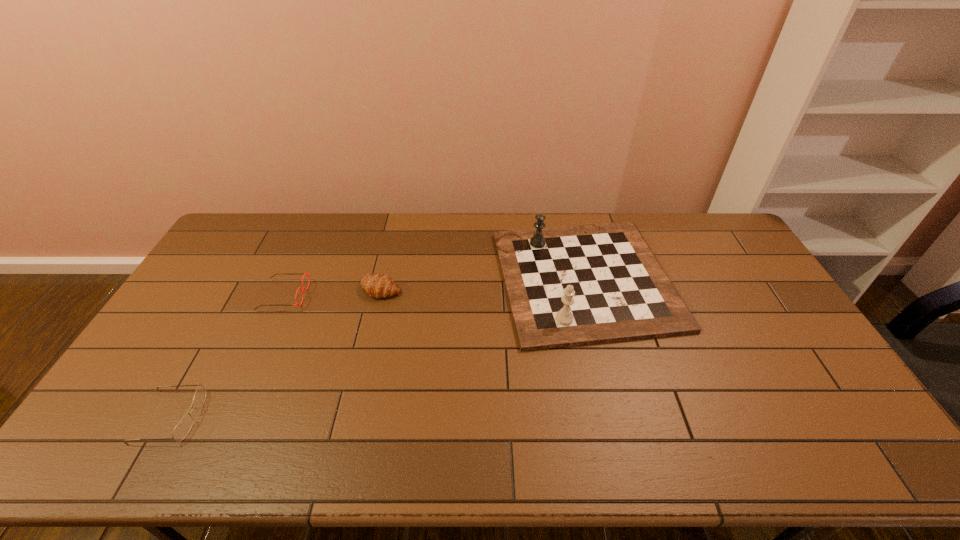
The image size is (960, 540). Find the location of `the rightmost object`. the rightmost object is located at coordinates pos(567,286).

Locate an element on the screen. gameboard is located at coordinates click(567, 286).

In order to click on crescent roll in this screenshot , I will do `click(377, 286)`.

Find the location of `the second object from left to right`. the second object from left to right is located at coordinates (306, 272).

The width and height of the screenshot is (960, 540). Identify the location of the right spectacles. (306, 272).

The width and height of the screenshot is (960, 540). I want to click on the leftmost object, so click(182, 429).

I want to click on the shorter spectacles, so click(x=182, y=429).

Where is `vacant space positioned 0.250m on the left of the tallest object`? Image resolution: width=960 pixels, height=540 pixels. vacant space positioned 0.250m on the left of the tallest object is located at coordinates (420, 279).

The image size is (960, 540). Find the location of `vacant space located on the right of the crescent roll`. vacant space located on the right of the crescent roll is located at coordinates (468, 288).

Find the location of a particular element. The image size is (960, 540). vacant region located on the front-facing side of the right spectacles is located at coordinates (324, 295).